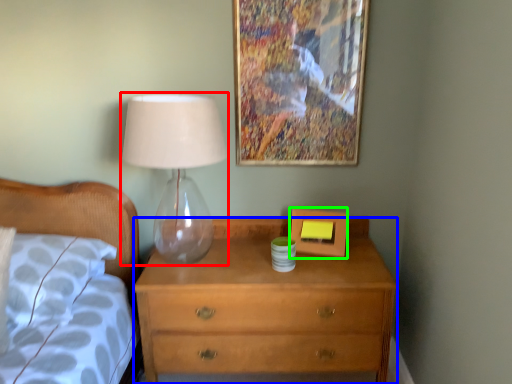
Question: Which object is the farthest from table lamp (highlighted by a red box)? Choose among these: chest of drawers (highlighted by a blue box) or picture frame (highlighted by a green box).

Choices:
 (A) chest of drawers
 (B) picture frame

Answer: (A)